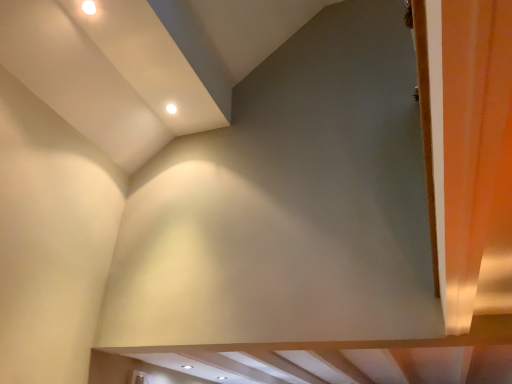
Question: Is orange fabric curtain at right taller than white glossy light fixture at upper center?

Choices:
 (A) no
 (B) yes

Answer: (B)

Question: Would you say white glossy light fixture at upper center is part of orange fabric curtain at right's contents?

Choices:
 (A) no
 (B) yes

Answer: (A)

Question: From a real-world perspective, is orange fabric curtain at right under white glossy light fixture at upper center?

Choices:
 (A) yes
 (B) no

Answer: (A)

Question: Is orange fabric curtain at right to the right of white glossy light fixture at upper center from the viewer's perspective?

Choices:
 (A) no
 (B) yes

Answer: (B)

Question: Is white glossy light fixture at upper center at the back of orange fabric curtain at right?

Choices:
 (A) no
 (B) yes

Answer: (A)

Question: Does orange fabric curtain at right have a lesser width compared to white glossy light fixture at upper center?

Choices:
 (A) no
 (B) yes

Answer: (A)

Question: Is white glossy light fixture at upper center looking in the opposite direction of orange fabric curtain at right?

Choices:
 (A) no
 (B) yes

Answer: (A)

Question: From the image's perspective, is white glossy light fixture at upper center beneath orange fabric curtain at right?

Choices:
 (A) yes
 (B) no

Answer: (B)

Question: Can you confirm if white glossy light fixture at upper center is bigger than orange fabric curtain at right?

Choices:
 (A) yes
 (B) no

Answer: (B)

Question: Can you confirm if white glossy light fixture at upper center is positioned to the left of orange fabric curtain at right?

Choices:
 (A) no
 (B) yes

Answer: (B)

Question: Is white glossy light fixture at upper center wider than orange fabric curtain at right?

Choices:
 (A) no
 (B) yes

Answer: (A)

Question: Is orange fabric curtain at right located within white glossy light fixture at upper center?

Choices:
 (A) no
 (B) yes

Answer: (A)

Question: In terms of size, does orange fabric curtain at right appear bigger or smaller than white glossy light fixture at upper center?

Choices:
 (A) small
 (B) big

Answer: (B)